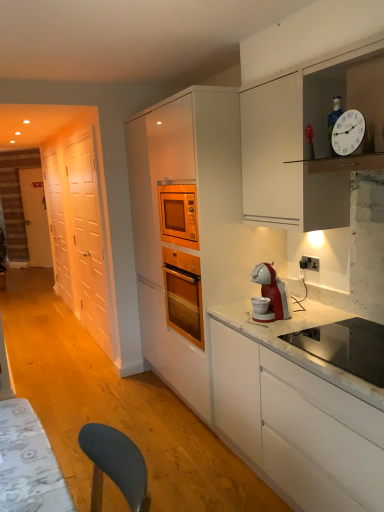
Question: In the image, is white wooden door at left on the left side or the right side of black plastic electrical outlet at upper right?

Choices:
 (A) left
 (B) right

Answer: (A)

Question: Is white wooden door at left in front of or behind black plastic electrical outlet at upper right in the image?

Choices:
 (A) behind
 (B) front

Answer: (A)

Question: Estimate the real-world distances between objects in this image. Which object is farther from the matte white cabinetry at center?

Choices:
 (A) black plastic electrical outlet at upper right
 (B) white glossy door at left, the second glass door positioned from the front
 (C) white glossy door at left, the first glass door when ordered from right to left
 (D) stainless steel sink at lower right
 (E) white plastic clock at upper right

Answer: (B)

Question: Which of these objects is positioned farthest from the stainless steel sink at lower right?

Choices:
 (A) matte white cabinetry at center
 (B) black plastic electrical outlet at upper right
 (C) white wooden door at left
 (D) white plastic clock at upper right
 (E) white glossy door at left, placed as the second glass door when sorted from right to left

Answer: (C)